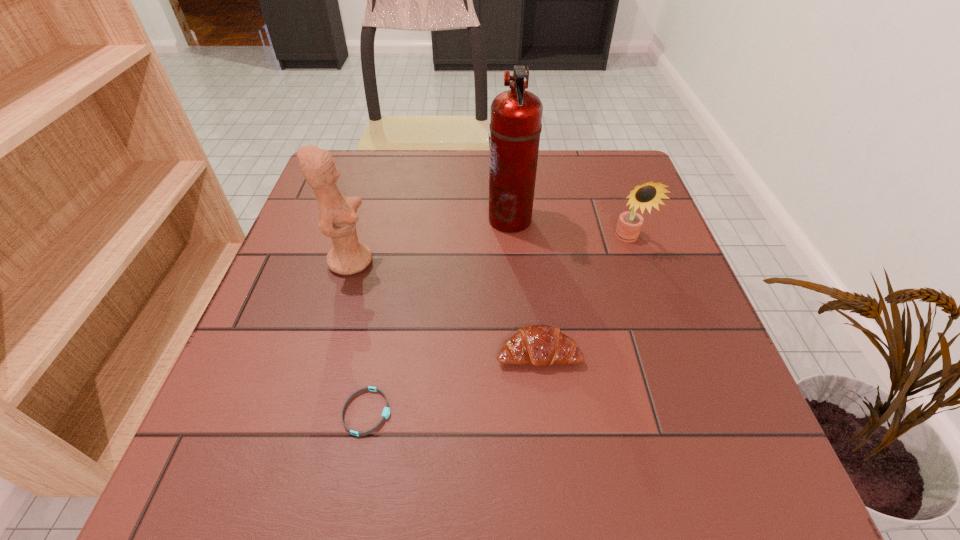
You are a GUI agent. You are given a task and a screenshot of the screen. Output one action in this format:
    pyautogui.click(x=<x>, y=<y>)
    Task: Click on the fire extinguisher
    The width and height of the screenshot is (960, 540).
    Given the screenshot: What is the action you would take?
    pyautogui.click(x=515, y=125)

Where is `figurine`? This screenshot has width=960, height=540. figurine is located at coordinates (337, 219).

Find the location of `the leftmost object`. the leftmost object is located at coordinates (337, 219).

Locate an element on the screen. sunflower is located at coordinates (629, 225).

Locate an element on the screen. Image resolution: width=960 pixels, height=540 pixels. the third shortest object is located at coordinates (629, 225).

The image size is (960, 540). I want to click on crescent roll, so pyautogui.click(x=540, y=345).

The height and width of the screenshot is (540, 960). What are the coordinates of `the second nearest object` in the screenshot? It's located at (540, 345).

Identify the location of wristband. Image resolution: width=960 pixels, height=540 pixels. (386, 411).

What are the coordinates of `the second object from left to right` in the screenshot? It's located at [x=386, y=411].

In order to click on vacant region located 0.390m on the side of the fire extinguisher with the handle and hose in this screenshot , I will do `click(326, 219)`.